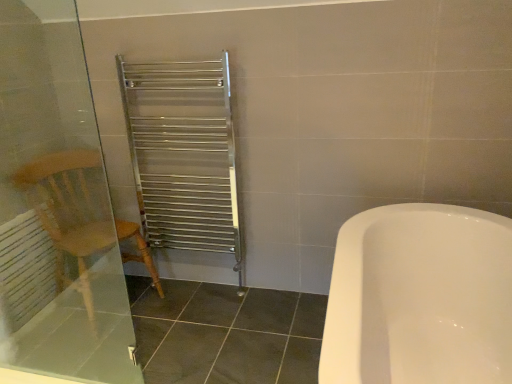
Question: Would you say wooden armchair at left is part of transparent glass screen door at left's contents?

Choices:
 (A) no
 (B) yes

Answer: (A)

Question: Does transparent glass screen door at left have a lesser height compared to wooden armchair at left?

Choices:
 (A) no
 (B) yes

Answer: (A)

Question: From the image's perspective, is transparent glass screen door at left beneath wooden armchair at left?

Choices:
 (A) yes
 (B) no

Answer: (B)

Question: Can you see transparent glass screen door at left touching wooden armchair at left?

Choices:
 (A) yes
 (B) no

Answer: (B)

Question: Can you confirm if transparent glass screen door at left is positioned to the right of wooden armchair at left?

Choices:
 (A) no
 (B) yes

Answer: (B)

Question: Is transparent glass screen door at left turned away from wooden armchair at left?

Choices:
 (A) no
 (B) yes

Answer: (B)

Question: Is wooden armchair at left in contact with white matte radiator at left?

Choices:
 (A) no
 (B) yes

Answer: (A)

Question: Is wooden armchair at left taller than white matte radiator at left?

Choices:
 (A) yes
 (B) no

Answer: (A)

Question: From a real-world perspective, is wooden armchair at left located beneath white matte radiator at left?

Choices:
 (A) no
 (B) yes

Answer: (A)

Question: Does wooden armchair at left have a smaller size compared to white matte radiator at left?

Choices:
 (A) yes
 (B) no

Answer: (B)

Question: From the image's perspective, is wooden armchair at left over white matte radiator at left?

Choices:
 (A) yes
 (B) no

Answer: (A)

Question: Does wooden armchair at left have a larger size compared to white matte radiator at left?

Choices:
 (A) yes
 (B) no

Answer: (A)

Question: Is transparent glass screen door at left oriented towards white matte radiator at left?

Choices:
 (A) yes
 (B) no

Answer: (B)